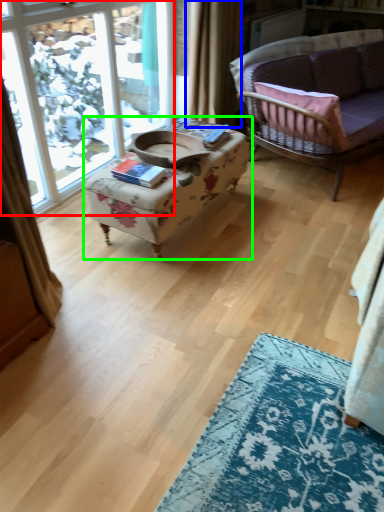
Question: Considering the real-world distances, which object is closest to window (highlighted by a red box)? curtain (highlighted by a blue box) or table (highlighted by a green box).

Choices:
 (A) curtain
 (B) table

Answer: (A)